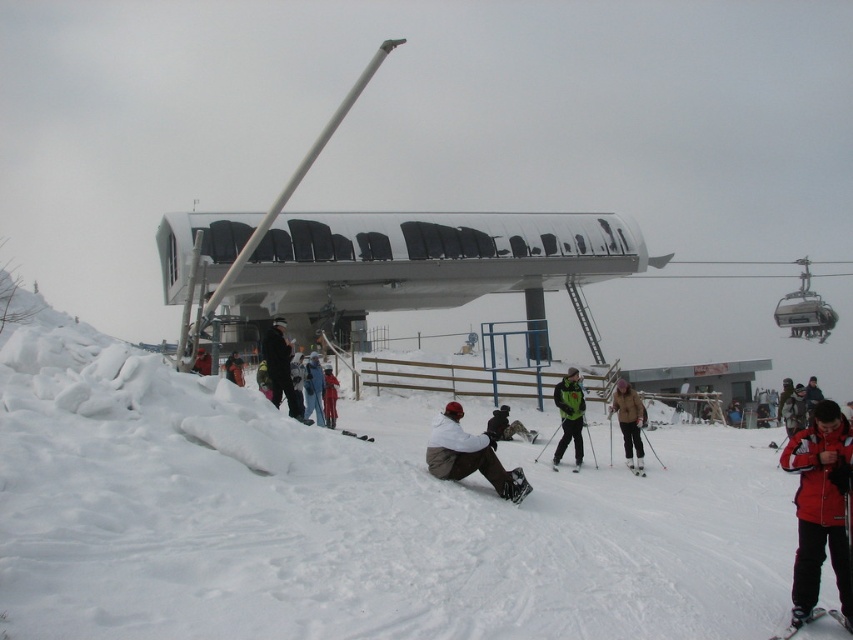
Which is behind, point (543, 593) or point (317, 416)?

Positioned behind is point (317, 416).

Which is more to the left, white powdery snow at lower left or blue jeans at lower center?

Positioned to the left is blue jeans at lower center.

In order to click on white powdery snow at lower left in this screenshot , I will do pos(347,518).

Can you confirm if green fabric jacket at center is positioned to the left of orange ski suit at center?

Incorrect, green fabric jacket at center is not on the left side of orange ski suit at center.

Which is above, green fabric jacket at center or orange ski suit at center?

orange ski suit at center is above.

At what (x,y) coordinates should I click in order to perform the action: click on green fabric jacket at center. Please return your answer as a coordinate pair (x, y). This screenshot has height=640, width=853. Looking at the image, I should click on (569, 417).

Consider the image. Can you confirm if black matte ski at lower right is shorter than orange ski suit at center?

Yes.

Does black matte ski at lower right have a greater height compared to orange ski suit at center?

In fact, black matte ski at lower right may be shorter than orange ski suit at center.

You are a GUI agent. You are given a task and a screenshot of the screen. Output one action in this format:
    pyautogui.click(x=<x>, y=<y>)
    Task: Click on the black matte ski at lower right
    
    Given the screenshot: What is the action you would take?
    pyautogui.click(x=811, y=621)